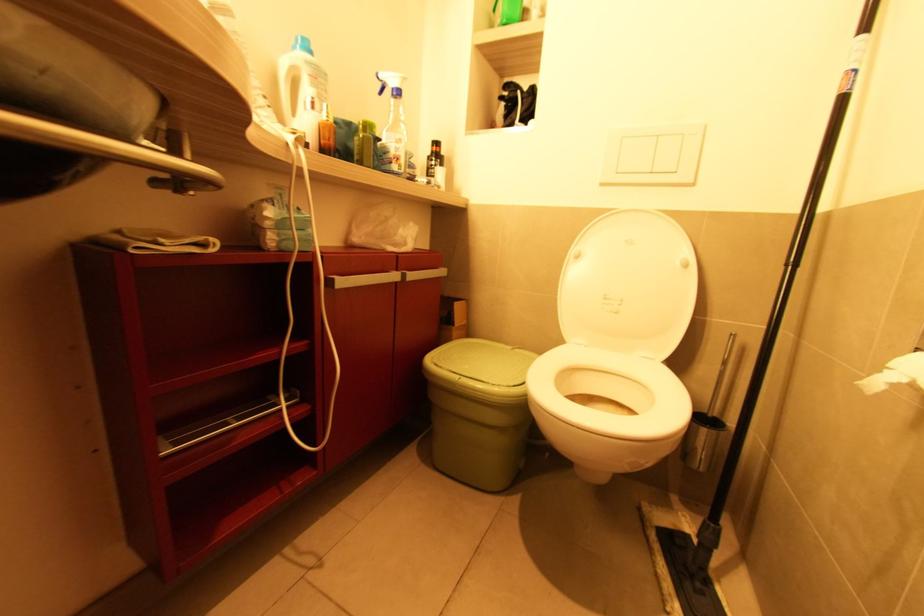
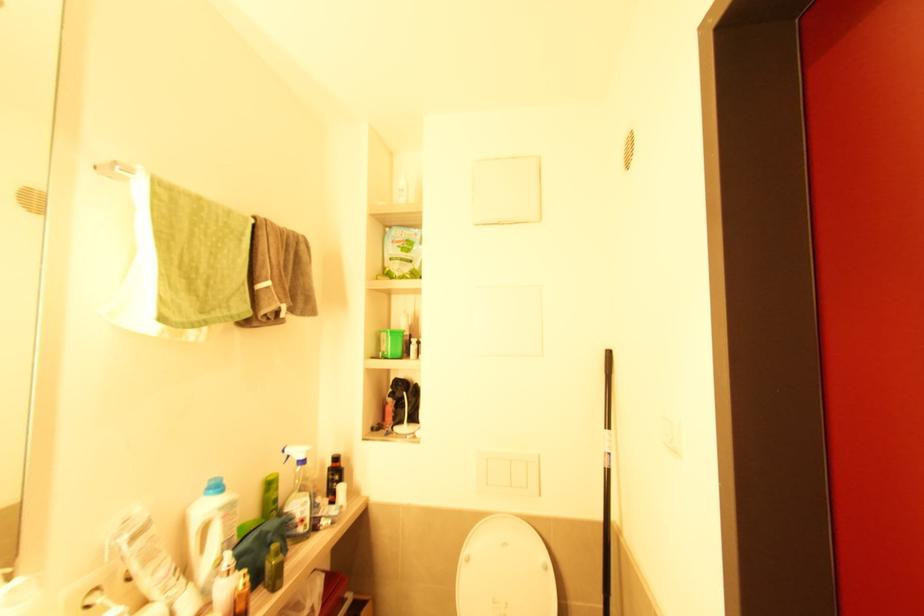
The point at (393,163) is marked in the first image. Where is the corresponding point in the second image?

(298, 527)